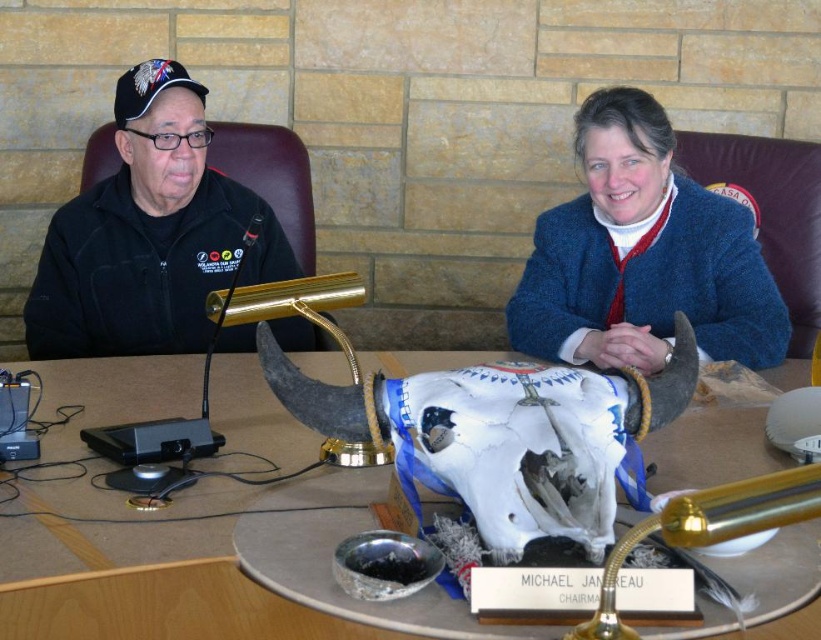
You are standing in front of the conference table and want to place a small notebook on the wooden table at center. However, there is a blue woolen sweater at upper right nearby. Which object is closer to you so that you can safely place the notebook without disturbing the sweater?

The wooden table at center is closer to the viewer than the blue woolen sweater at upper right, so you can safely place the notebook on the wooden table at center without disturbing the sweater.

You are a photographer setting up for a group photo in the room. You need to position a light source so it illuminates both the blue woolen sweater at upper right and the black fleece jacket at left. Based on their positions, which object should be placed closer to the light source to ensure even illumination?

The blue woolen sweater at upper right should be placed closer to the light source because it is positioned below the black fleece jacket at left, meaning it is farther from the light if placed similarly. Moving it closer balances the illumination.

You are standing in front of the wooden table at center and want to place a 90 cm long document on it. Will the document fit on the table?

The wooden table at center is 89.71 centimeters from viewer, so the document may not fit as it is slightly longer than the table.